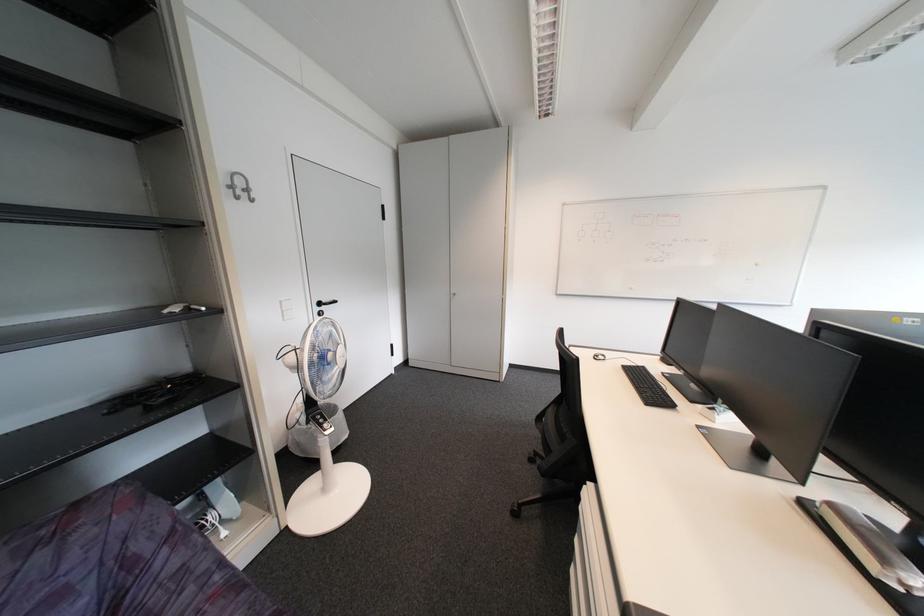
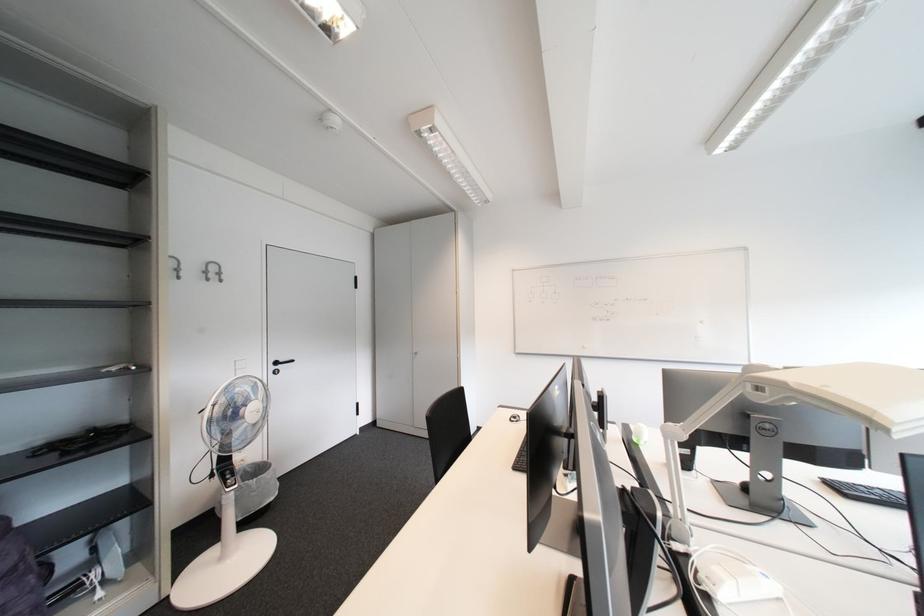
Question: The first image is from the beginning of the video and the second image is from the end. How did the camera likely rotate when shooting the video?

Choices:
 (A) Left
 (B) Right
 (C) Up
 (D) Down

Answer: (C)